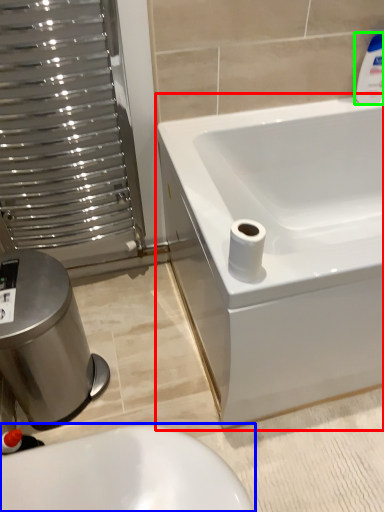
Question: Which object is the closest to the bathtub (highlighted by a red box)? Choose among these: toilet (highlighted by a blue box) or cleaning product (highlighted by a green box).

Choices:
 (A) toilet
 (B) cleaning product

Answer: (B)